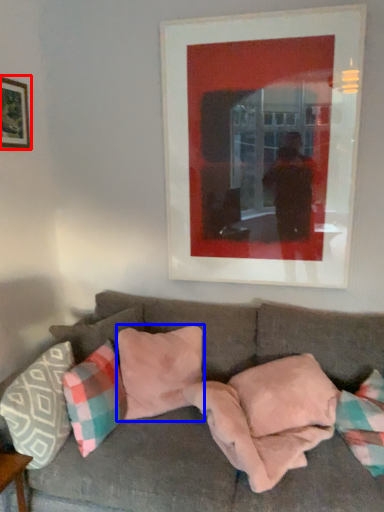
Question: Which object appears closest to the camera in this image, picture frame (highlighted by a red box) or pillow (highlighted by a blue box)?

Choices:
 (A) picture frame
 (B) pillow

Answer: (B)